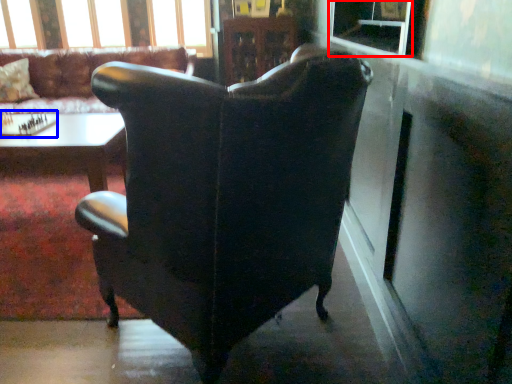
Question: Among these objects, which one is nearest to the camera, window screen (highlighted by a red box) or board game (highlighted by a blue box)?

Choices:
 (A) window screen
 (B) board game

Answer: (A)